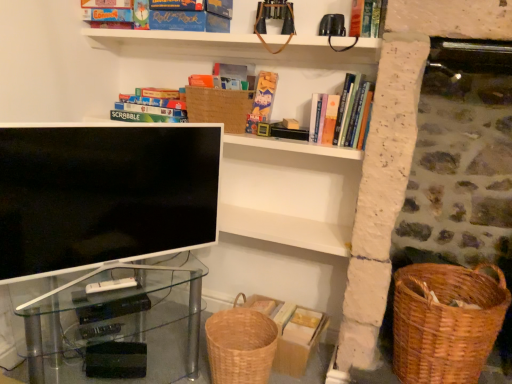
Question: Choose the correct answer: Is woven brown basket at lower center, positioned as the first basket container in left-to-right order, inside matte cardboard book at upper center, positioned as the third book in right-to-left order, or outside it?

Choices:
 (A) inside
 (B) outside

Answer: (B)

Question: From the image's perspective, is woven brown basket at lower center, positioned as the first basket container in left-to-right order, above or below matte cardboard book at upper center, the second book in the left-to-right sequence?

Choices:
 (A) above
 (B) below

Answer: (B)

Question: Which object is positioned closest to the hardcover book at upper right, marked as the 3th book in a left-to-right arrangement?

Choices:
 (A) matte cardboard scrabble board game at upper left, which is the first book from left to right
 (B) hardcover book at upper center, acting as the first book starting from the right
 (C) woven brown basket at upper center
 (D) woven brown basket at lower center, positioned as the first basket container in left-to-right order
 (E) matte white tv at center

Answer: (B)

Question: Which is nearer to the hardcover book at upper center, acting as the first book starting from the right?

Choices:
 (A) matte cardboard scrabble board game at upper left, which is the fourth book from right to left
 (B) hardcover book at upper right, marked as the 3th book in a left-to-right arrangement
 (C) woven brown basket at upper center
 (D) woven brown basket at lower right, arranged as the second basket container when viewed from the left
 (E) woven brown basket at lower center, arranged as the 2th basket container when viewed from the right

Answer: (B)